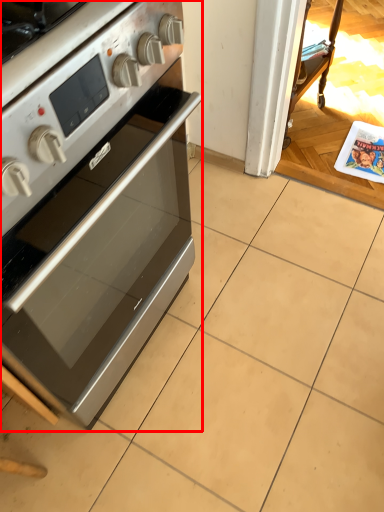
Question: Observing the image, what is the correct spatial positioning of home appliance (annotated by the red box) in reference to magazine?

Choices:
 (A) left
 (B) right

Answer: (A)